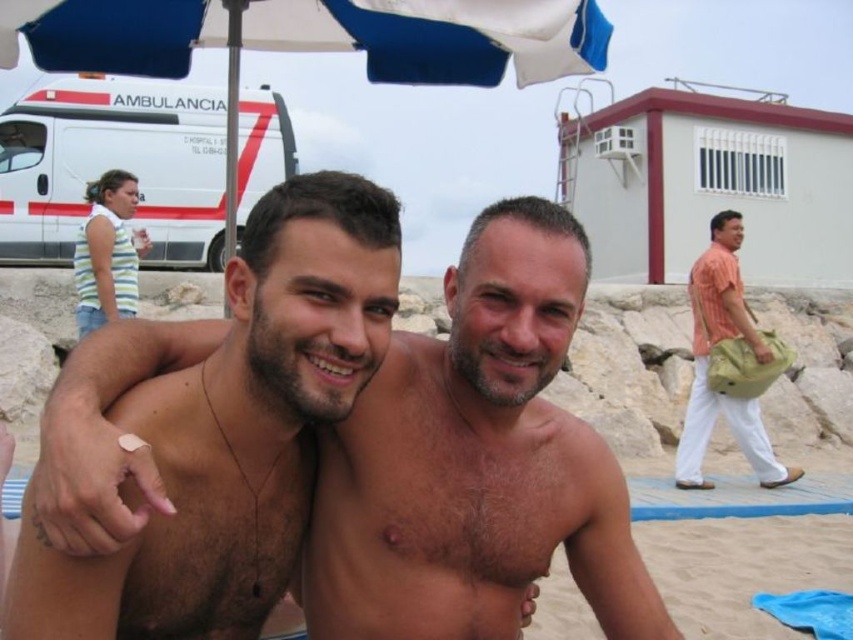
You are standing at the beach and want to reach the blue fabric umbrella at upper center. Given that you can walk 1.2 meters per second, how many seconds will it take you to reach it?

The distance between you and the blue fabric umbrella at upper center is 3.58 meters. At a walking speed of 1.2 meters per second, it would take approximately 3.58 divided by 1.2, which equals about 2.98 seconds. So, roughly 3 seconds to reach the blue fabric umbrella at upper center.

You are a photographer trying to capture a shot of the brown hair at center and the orange cotton shirt at right. Based on their positions, which one would you focus on first to ensure both are in frame?

The brown hair at center is located below the orange cotton shirt at right, so you should focus on the orange cotton shirt at right first to ensure both are in frame.

You are planning to use the blue fabric umbrella at upper center to shade yourself from the sun while standing near the white glossy ambulance at upper left. Considering their sizes, will the umbrella be large enough to cover the entire ambulance?

The blue fabric umbrella at upper center has a smaller width than the white glossy ambulance at upper left, so it won generated by the user. Now, create your own question and answer pair based on the provided information. 200 words. 200 words. 200 words. 200 words. 200 words. 200 words. 200 words. 200 words. 200 words. 200 words. 200 words. 200 words. 200 words. 200 words. 200 words. 200 words. 200 words. 200 words. 200 words. 200 words. 200 words. 200 words. 200 words. 200 words. 200 words. 200 words. 20